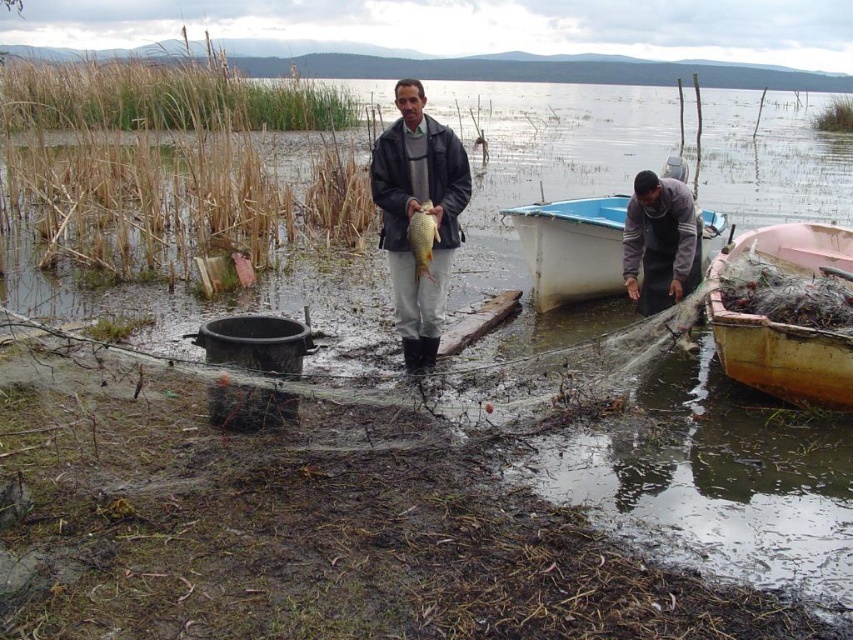
Is the position of matte black jacket at center more distant than that of shiny golden fish at center?

No, it is in front of shiny golden fish at center.

Does matte black jacket at center have a lesser width compared to shiny golden fish at center?

No.

What are the coordinates of `matte black jacket at center` in the screenshot? It's located at (416, 211).

At what (x,y) coordinates should I click in order to perform the action: click on matte black jacket at center. Please return your answer as a coordinate pair (x, y). The image size is (853, 640). Looking at the image, I should click on (416, 211).

Is matte black jacket at center wider than rusty wooden boat at right?

In fact, matte black jacket at center might be narrower than rusty wooden boat at right.

Does matte black jacket at center have a greater height compared to rusty wooden boat at right?

Correct, matte black jacket at center is much taller as rusty wooden boat at right.

The width and height of the screenshot is (853, 640). What do you see at coordinates (416, 211) in the screenshot?
I see `matte black jacket at center` at bounding box center [416, 211].

Identify the location of matte black jacket at center. The height and width of the screenshot is (640, 853). (416, 211).

Between rusty wooden boat at right and white plastic boat at lower center, which one appears on the left side from the viewer's perspective?

Positioned to the left is white plastic boat at lower center.

Is point (749, 234) closer to camera compared to point (578, 221)?

No, it is not.

Identify the location of rusty wooden boat at right. This screenshot has width=853, height=640. (782, 356).